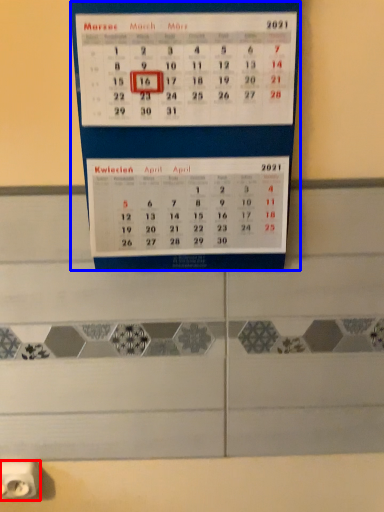
Question: Among these objects, which one is nearest to the camera, power plugs and sockets (highlighted by a red box) or bulletin board (highlighted by a blue box)?

Choices:
 (A) power plugs and sockets
 (B) bulletin board

Answer: (B)